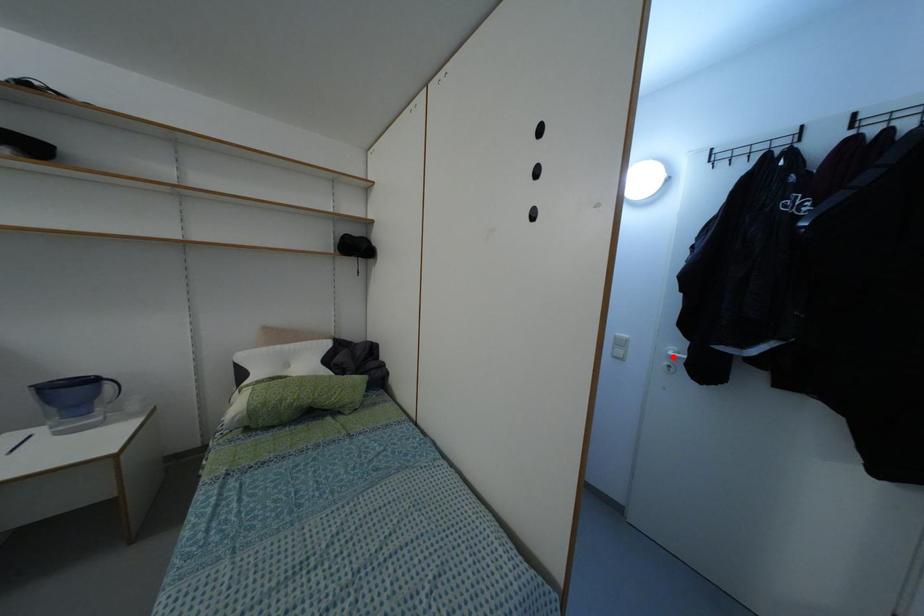
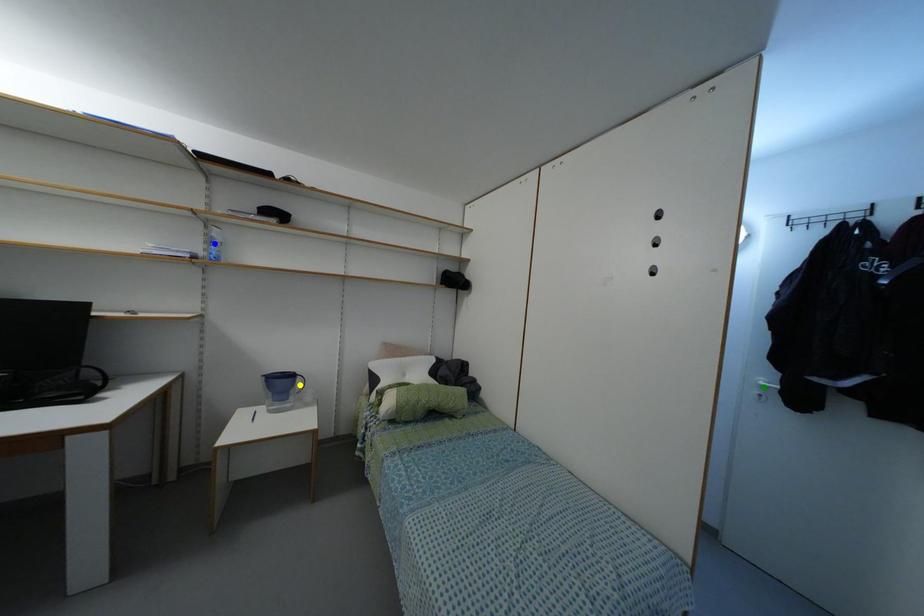
Question: I am providing you with two images of the same scene from different viewpoints. A red point is marked on the first image. You are given multiple points on the second image. In image 2, which mark is for the same physical point as the one in image 1?

Choices:
 (A) green point
 (B) blue point
 (C) yellow point

Answer: (A)